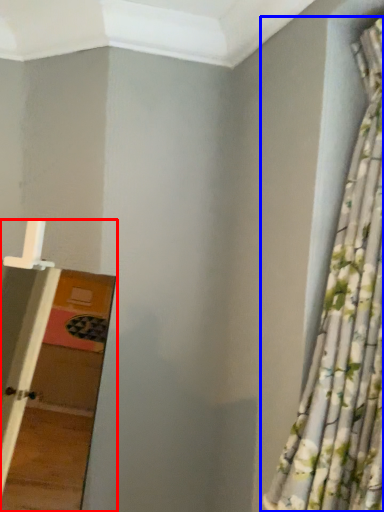
Question: Among these objects, which one is nearest to the camera, ladder (highlighted by a red box) or curtain (highlighted by a blue box)?

Choices:
 (A) ladder
 (B) curtain

Answer: (A)